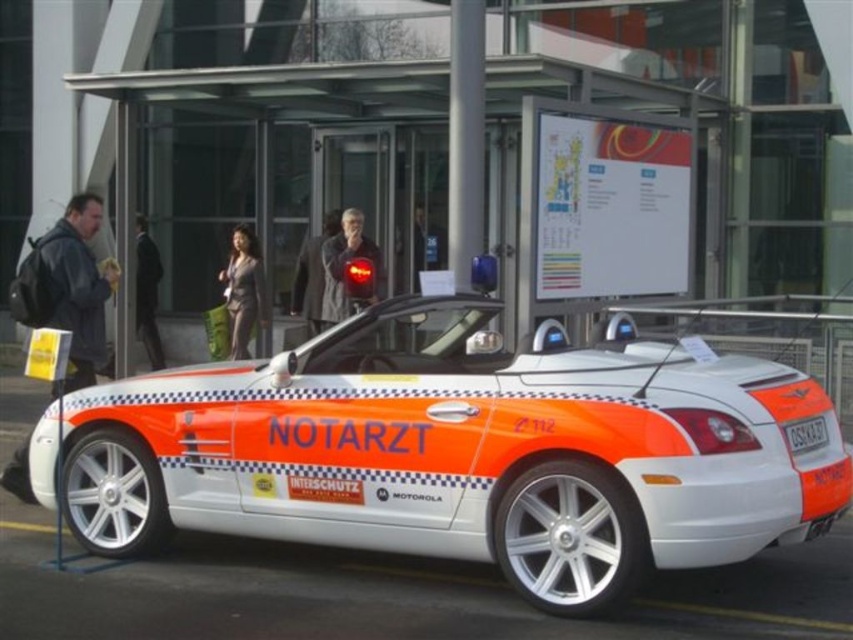
Question: Is white metallic car at center bigger than white plastic license plate at center?

Choices:
 (A) yes
 (B) no

Answer: (A)

Question: Which object is farther from the camera taking this photo?

Choices:
 (A) white plastic license plate at center
 (B) white metallic car at center

Answer: (A)

Question: Does white metallic car at center have a smaller size compared to white plastic license plate at center?

Choices:
 (A) no
 (B) yes

Answer: (A)

Question: Is white metallic car at center below white plastic license plate at center?

Choices:
 (A) no
 (B) yes

Answer: (A)